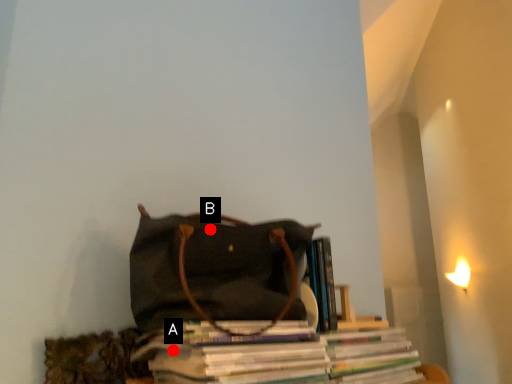
Question: Two points are circled on the image, labeled by A and B beside each circle. Which point is closer to the camera taking this photo?

Choices:
 (A) A is closer
 (B) B is closer

Answer: (A)